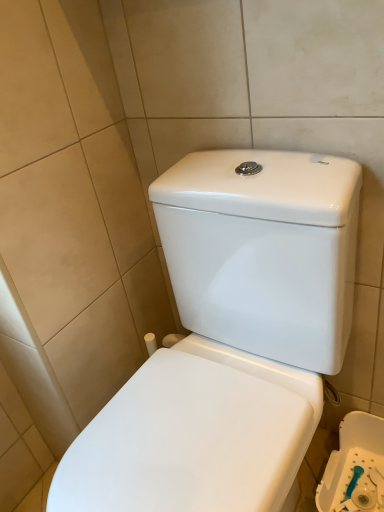
Question: Is white glossy toilet at center inside the boundaries of white glossy toilet at lower right, or outside?

Choices:
 (A) inside
 (B) outside

Answer: (B)

Question: Would you say white glossy toilet at center is to the left or to the right of white glossy toilet at lower right in the picture?

Choices:
 (A) right
 (B) left

Answer: (B)

Question: From a real-world perspective, is white glossy toilet at center positioned above or below white glossy toilet at lower right?

Choices:
 (A) below
 (B) above

Answer: (B)

Question: From the image's perspective, is white glossy toilet at lower right located above or below white glossy toilet at center?

Choices:
 (A) above
 (B) below

Answer: (B)

Question: In terms of size, does white glossy toilet at lower right appear bigger or smaller than white glossy toilet at center?

Choices:
 (A) big
 (B) small

Answer: (B)

Question: Is white glossy toilet at lower right to the left or to the right of white glossy toilet at center in the image?

Choices:
 (A) left
 (B) right

Answer: (B)

Question: Considering the positions of white glossy toilet at lower right and white glossy toilet at center in the image, is white glossy toilet at lower right wider or thinner than white glossy toilet at center?

Choices:
 (A) wide
 (B) thin

Answer: (B)